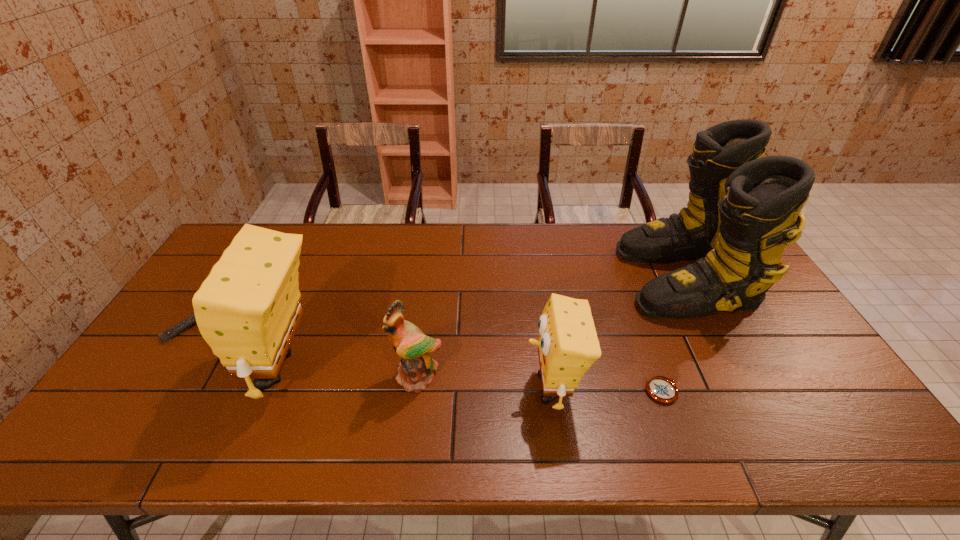
Where is `the taller sponge`? This screenshot has height=540, width=960. the taller sponge is located at coordinates (248, 309).

Where is `the second tallest object`? The image size is (960, 540). the second tallest object is located at coordinates (248, 309).

You are a GUI agent. You are given a task and a screenshot of the screen. Output one action in this format:
    pyautogui.click(x=<x>, y=<y>)
    Task: Click on the right sponge
    The image size is (960, 540).
    Given the screenshot: What is the action you would take?
    pyautogui.click(x=568, y=345)

Find the location of `the fourth object from left to right`. the fourth object from left to right is located at coordinates (568, 345).

Locate an element on the screen. The height and width of the screenshot is (540, 960). remote control is located at coordinates (167, 335).

Locate an element on the screen. This screenshot has height=540, width=960. ski boots is located at coordinates (743, 208).

Find the location of a particular element. This screenshot has height=540, width=960. parrot is located at coordinates (415, 370).

You are a GUI agent. You are given a task and a screenshot of the screen. Output one action in this format:
    pyautogui.click(x=<x>, y=<y>)
    Task: Click on the compass
    This screenshot has width=960, height=540.
    Given the screenshot: What is the action you would take?
    pyautogui.click(x=661, y=389)

You are a GUI agent. You are given a task and a screenshot of the screen. Output one action in this format:
    pyautogui.click(x=<x>, y=<y>)
    Task: Click on the free spot located on the face of the second tallest object
    The width and height of the screenshot is (960, 540).
    Given the screenshot: What is the action you would take?
    pyautogui.click(x=200, y=368)

Find the location of a particular element. Image resolution: width=960 pixels, height=540 pixels. blank space located on the face of the second tallest object is located at coordinates (188, 368).